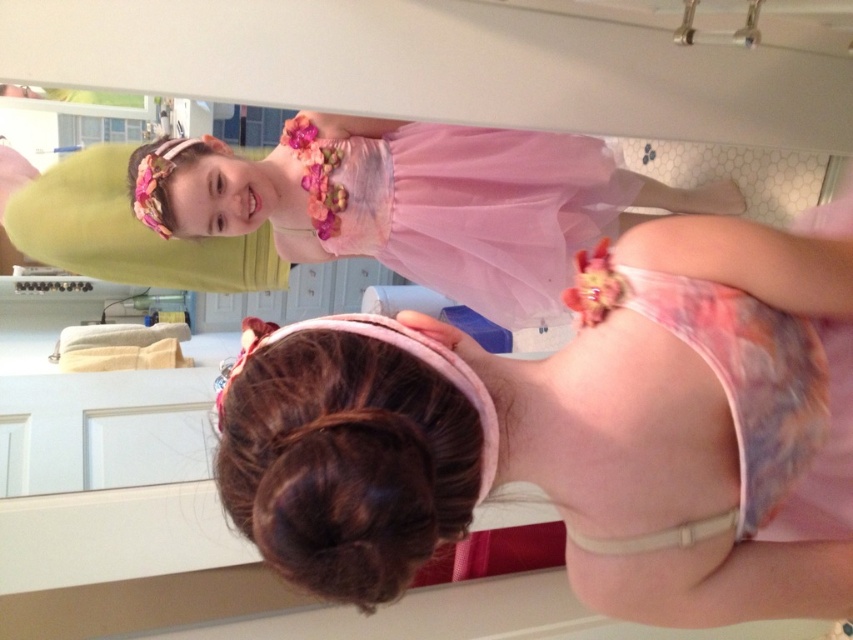
Looking at this image, you are standing in the dressing room and need to reach both points marked on the floor. Which point, point (440, 470) or point (618, 179), is closer to you?

Point (440, 470) is closer to you than point (618, 179).

You are helping someone choose between two outfits in a dressing room. You see the pink tulle dress at upper center and the brownhair at center. Which outfit is closer to you?

The pink tulle dress at upper center is closer to you because it is further to the viewer than the brownhair at center.

You are standing in a dressing room and need to reach the point marked as point (483, 132). If you are 1.58 meters away from it, can you comfortably step forward to touch it without moving any furniture?

The point (483, 132) is 1.58 meters away from you, so you can comfortably step forward to touch it without needing to move any furniture as the distance is within a reachable range.